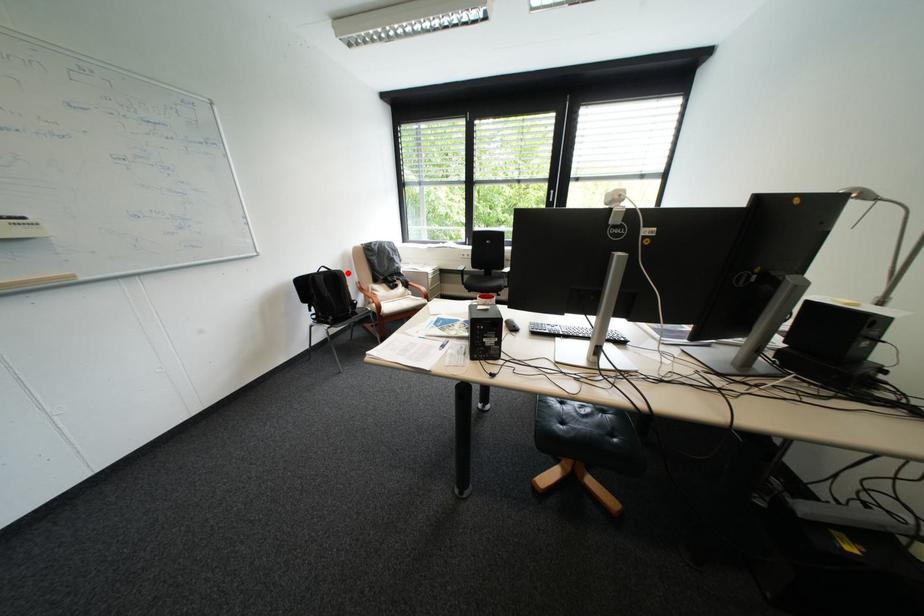
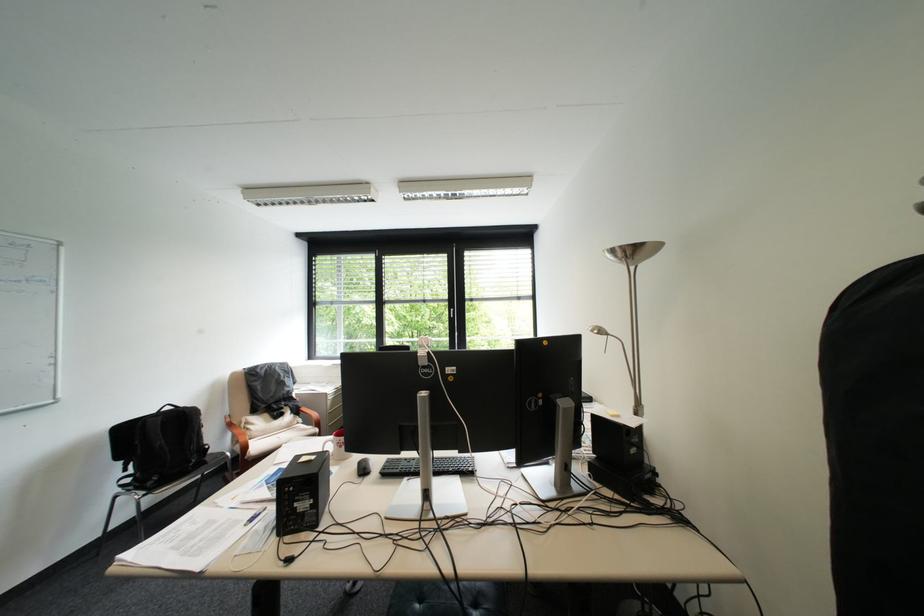
Locate, in the second image, the point that corresponds to the highlighted location in the first image.

(198, 411)